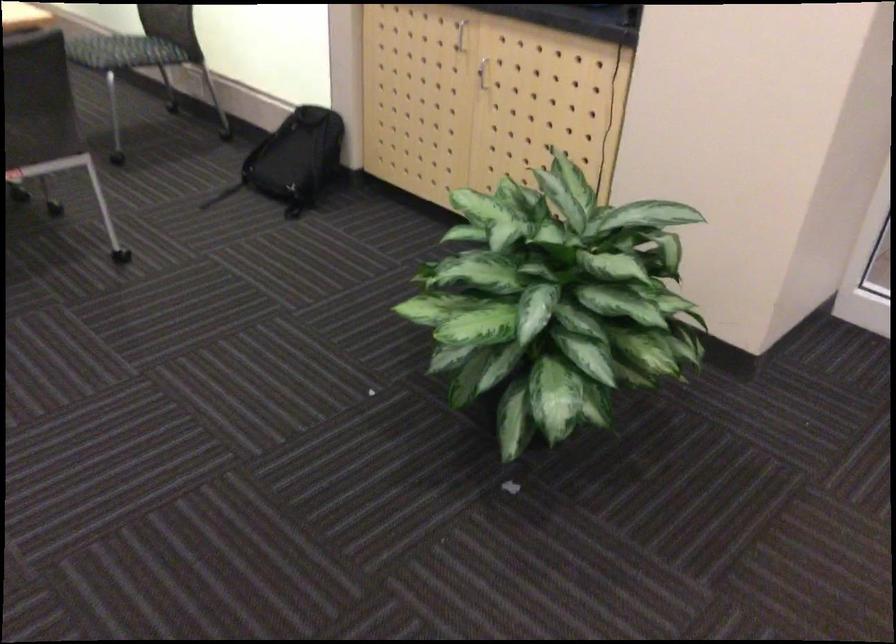
Identify the location of chair sitting surface. (122, 51).